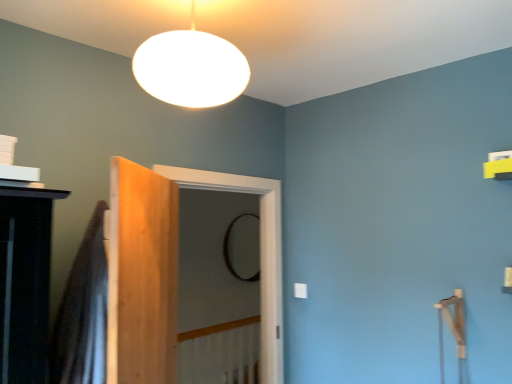
Question: From their relative heights in the image, would you say black glass mirror at center is taller or shorter than white matte/soft lampshade at upper center?

Choices:
 (A) tall
 (B) short

Answer: (A)

Question: Looking at the image, does black glass mirror at center seem bigger or smaller compared to white matte/soft lampshade at upper center?

Choices:
 (A) big
 (B) small

Answer: (B)

Question: Which object is positioned closest to the light brown wood door at center?

Choices:
 (A) clear glass screen door at center
 (B) translucent fabric shower curtain at left
 (C) white matte/soft lampshade at upper center
 (D) black glass mirror at center

Answer: (B)

Question: Considering the real-world distances, which object is closest to the white matte/soft lampshade at upper center?

Choices:
 (A) black glass mirror at center
 (B) light brown wood door at center
 (C) clear glass screen door at center
 (D) translucent fabric shower curtain at left

Answer: (B)